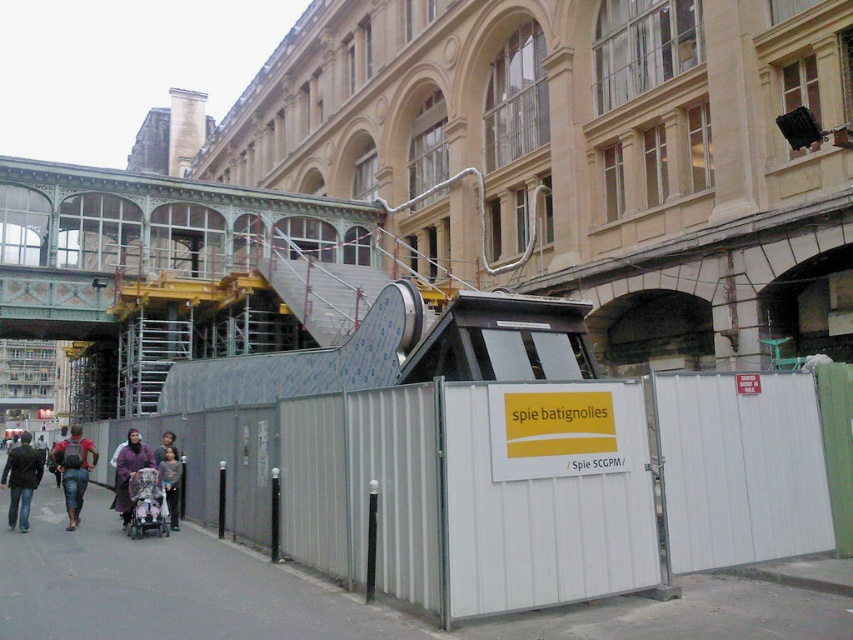
You are a construction worker who just arrived at the site. You see the white metal fence at lower center and the dark brown leather jacket at lower left. Which object is closer to you?

The white metal fence at lower center is closer to you because it is in front of the dark brown leather jacket at lower left.

You are standing at the construction site and want to know which of the two points, point (288, 269) or point (164, 481), is closer to you. Can you determine this based on their positions?

Point (288, 269) is closer to you because it is further to the viewer than point (164, 481).